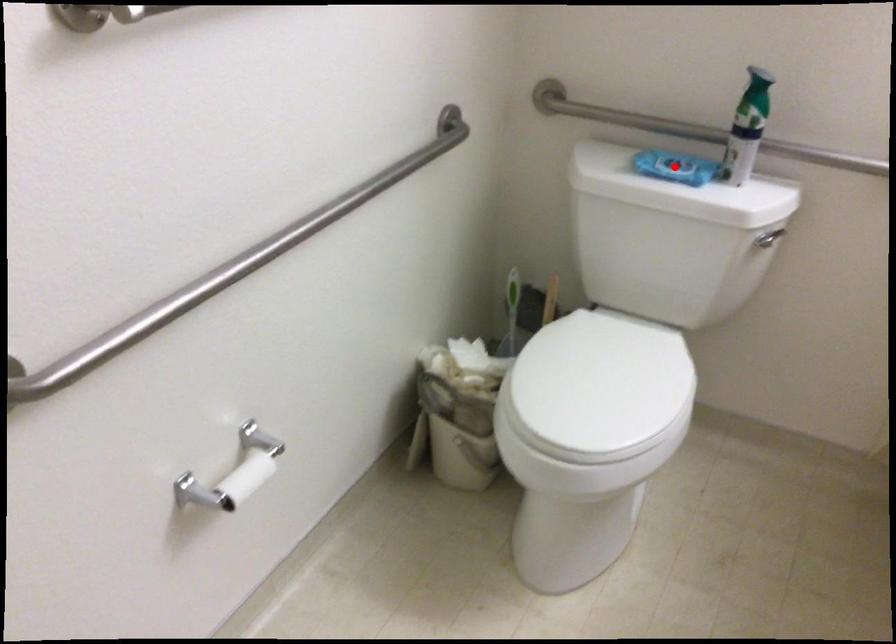
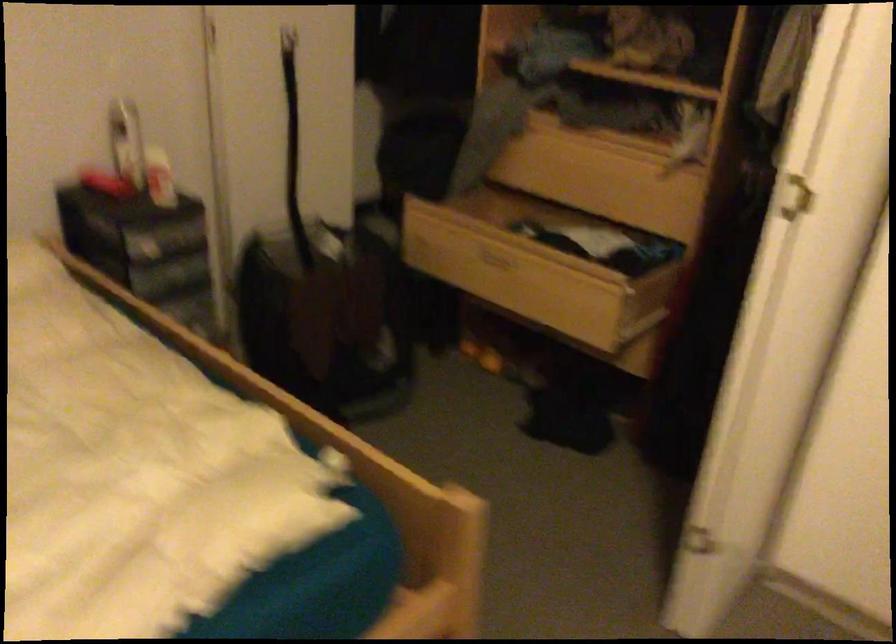
Question: I am providing you with two images of the same scene from different viewpoints. A red point is marked on the first image. Can you still see the location of the red point in image 2?

Choices:
 (A) Yes
 (B) No

Answer: (B)